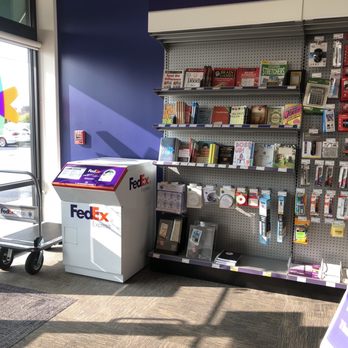
Identify the location of window. This screenshot has width=348, height=348. (14, 155).